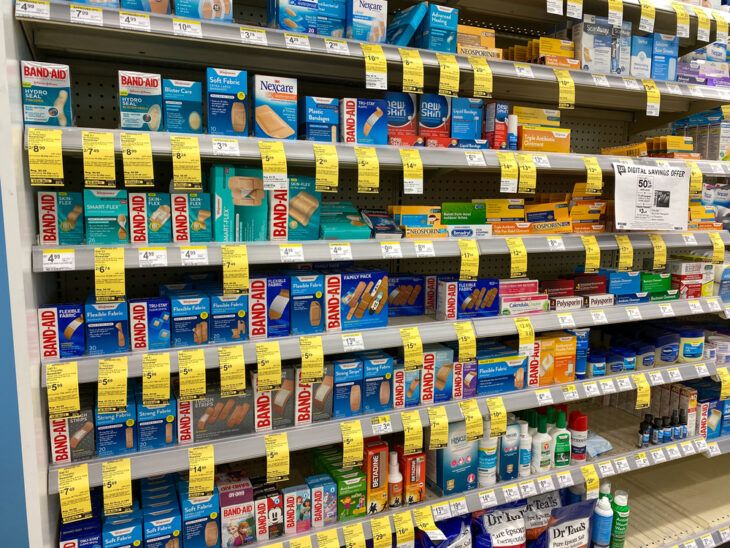
Where is `clear space on shelf`? clear space on shelf is located at coordinates pos(96,106), pos(590,130), pos(664,511), pos(610,428), pos(249,10).